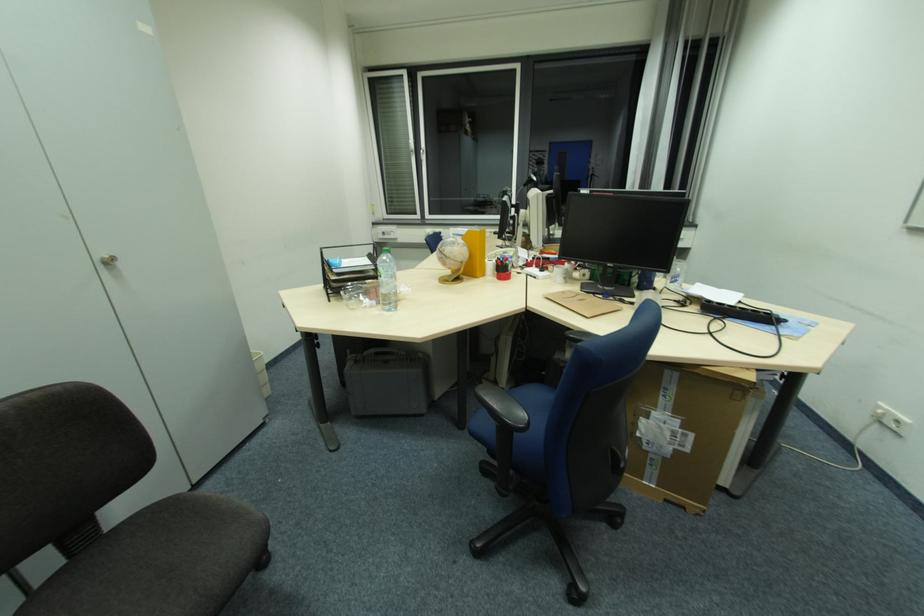
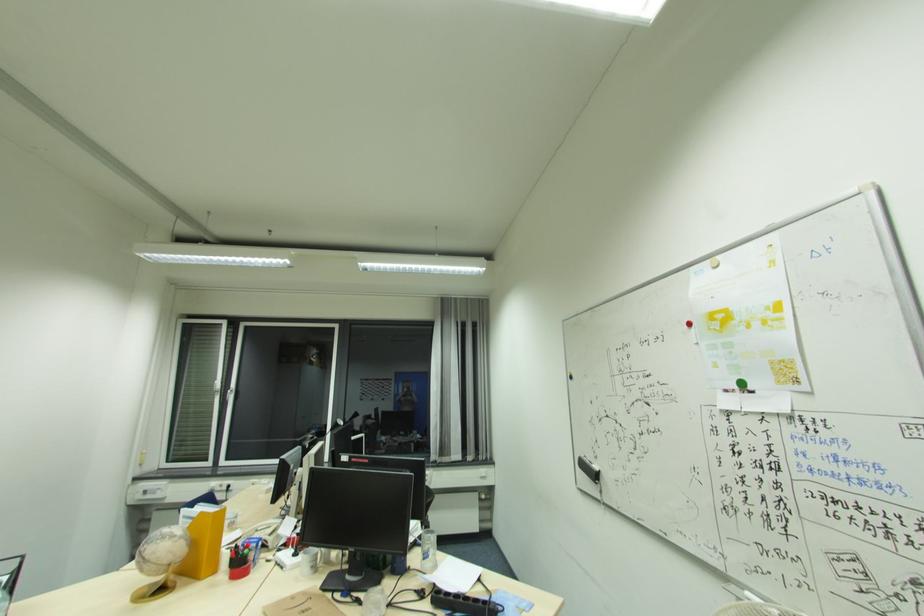
In the second image, find the point that corresponds to [563,280] in the first image.

(310, 570)